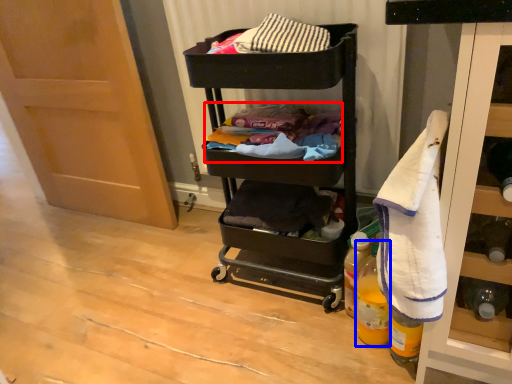
Question: Which object is further to the camera taking this photo, laundry (highlighted by a red box) or bottle (highlighted by a blue box)?

Choices:
 (A) laundry
 (B) bottle

Answer: (A)